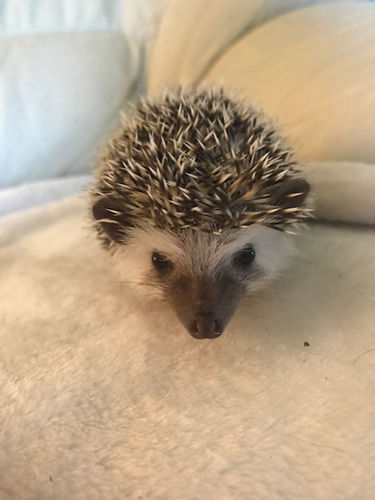
Locate an element on the screen. cushions is located at coordinates (53, 99), (299, 91).